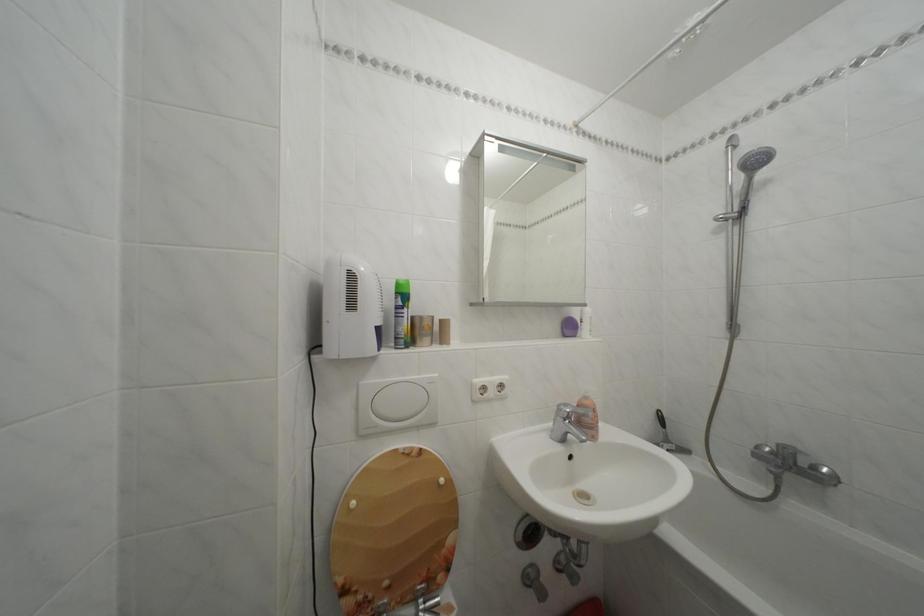
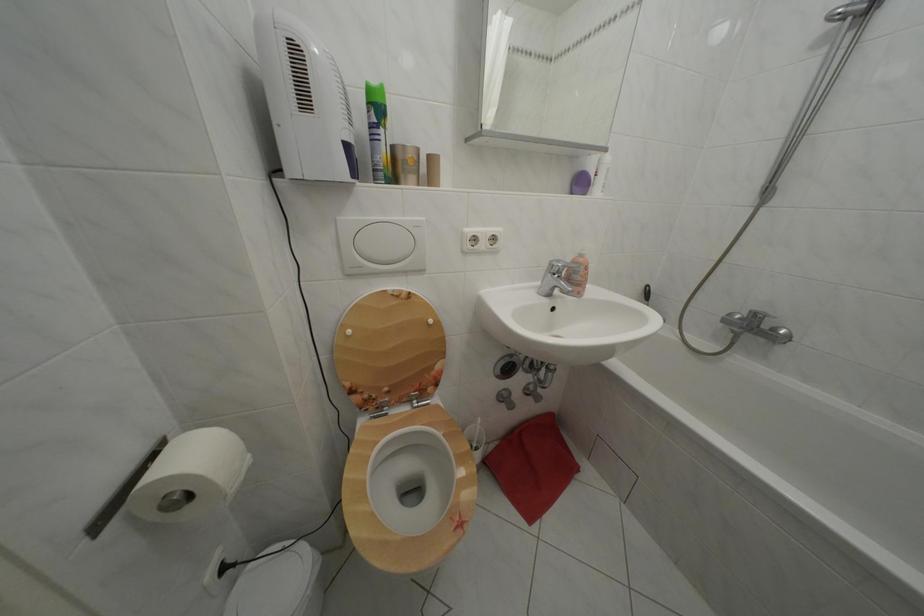
Where in the second image is the point corresponding to (362,509) from the first image?

(358, 338)